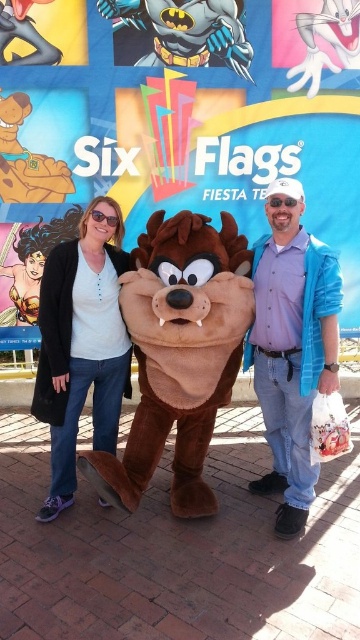
Question: Is blue denim jeans at center to the left of matte black sweater at left from the viewer's perspective?

Choices:
 (A) no
 (B) yes

Answer: (A)

Question: From the image, what is the correct spatial relationship of brown plush at center in relation to matte black sweater at left?

Choices:
 (A) above
 (B) below

Answer: (B)

Question: Which point is closer to the camera taking this photo?

Choices:
 (A) (294, 477)
 (B) (237, 346)

Answer: (B)

Question: Which object is closer to the camera taking this photo?

Choices:
 (A) brown plush at center
 (B) blue denim jeans at center
 (C) matte black sweater at left

Answer: (A)

Question: Observing the image, what is the correct spatial positioning of brown plush at center in reference to blue denim jeans at center?

Choices:
 (A) below
 (B) above

Answer: (A)

Question: Which object is farther from the camera taking this photo?

Choices:
 (A) blue denim jeans at center
 (B) matte black sweater at left
 (C) brown plush at center

Answer: (B)